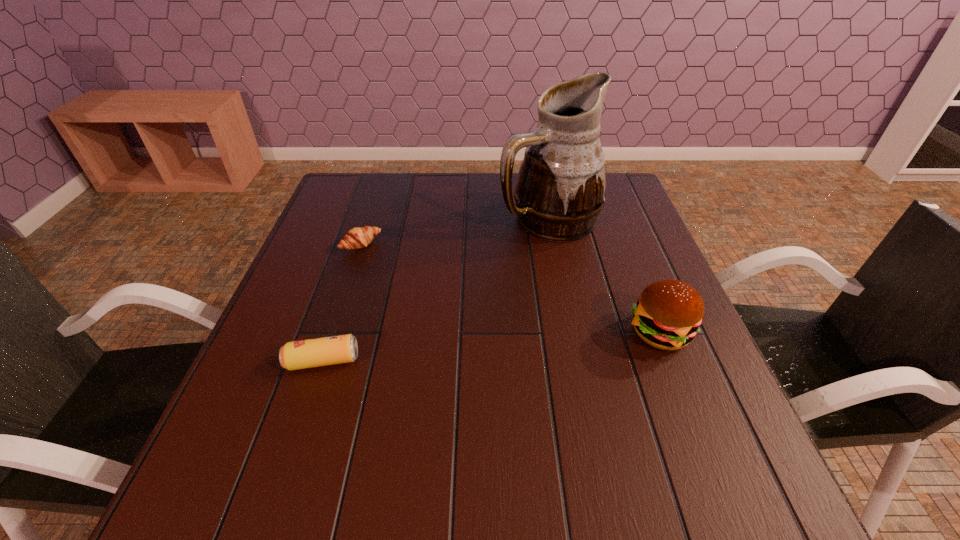
This screenshot has height=540, width=960. What are the coordinates of `beer can` in the screenshot? It's located at (325, 351).

Where is `the third shortest object`? the third shortest object is located at coordinates (668, 314).

The height and width of the screenshot is (540, 960). I want to click on pitcher, so click(x=560, y=191).

In order to click on pastry in this screenshot , I will do `click(356, 238)`.

In order to click on vacant space situated 0.250m on the right of the beer can in this screenshot , I will do `click(483, 361)`.

The width and height of the screenshot is (960, 540). I want to click on vacant space located on the back of the hamburger, so click(x=636, y=273).

Identify the location of free space located 0.280m from the spout of the tallest object. The image size is (960, 540). (499, 316).

The height and width of the screenshot is (540, 960). Find the location of `vacant region located from the spout of the tallest object`. vacant region located from the spout of the tallest object is located at coordinates (492, 332).

You are a GUI agent. You are given a task and a screenshot of the screen. Output one action in this format:
    pyautogui.click(x=<x>, y=<y>)
    Task: Click on the free space located from the spout of the tallest object
    
    Given the screenshot: What is the action you would take?
    pyautogui.click(x=495, y=326)

Locate an element on the screen. The image size is (960, 540). vacant space located on the front-facing side of the pastry is located at coordinates tap(416, 292).